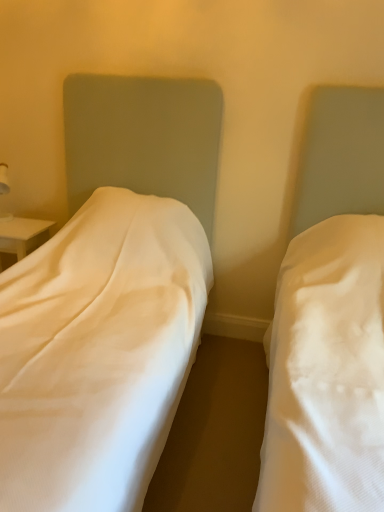
This screenshot has height=512, width=384. What are the coordinates of `white fabric bed at left` in the screenshot? It's located at (110, 302).

What do you see at coordinates (110, 302) in the screenshot? The height and width of the screenshot is (512, 384). I see `white fabric bed at left` at bounding box center [110, 302].

Where is `white fabric bed at left`? white fabric bed at left is located at coordinates (110, 302).